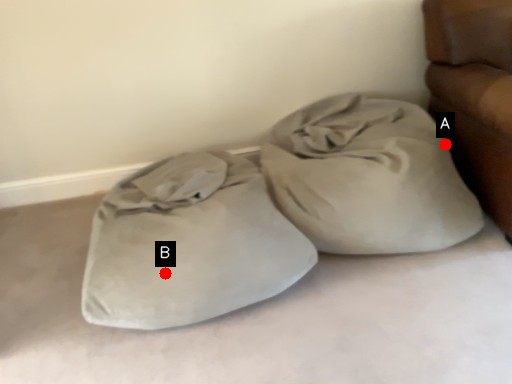
Question: Two points are circled on the image, labeled by A and B beside each circle. Which of the following is the closest to the observer?

Choices:
 (A) A is closer
 (B) B is closer

Answer: (B)